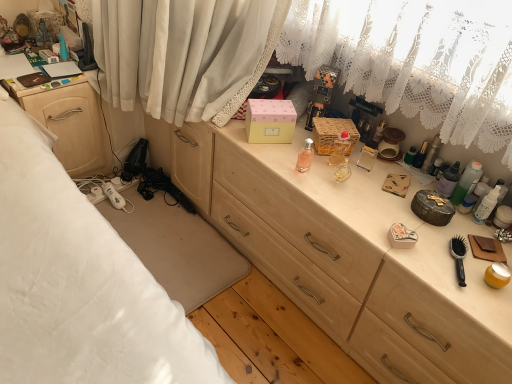
This screenshot has width=512, height=384. What are the coordinates of `unoccupied area in front of white glossy lotion at right, which ranks as the first toiletry in right-to-left order` in the screenshot? It's located at (469, 241).